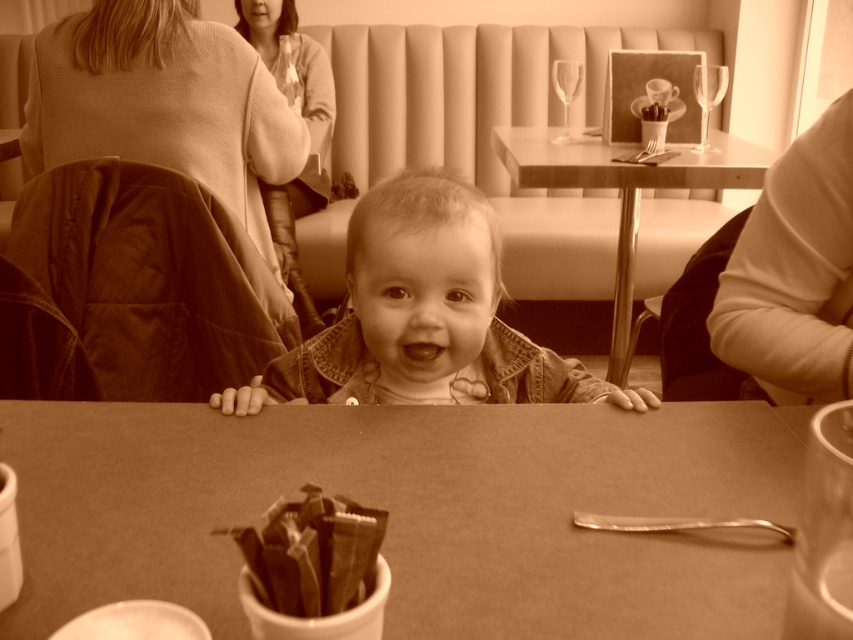
Who is shorter, smooth brown table at center or denim jacket at center?

With less height is smooth brown table at center.

Can you confirm if smooth brown table at center is positioned to the right of denim jacket at center?

No, smooth brown table at center is not to the right of denim jacket at center.

The image size is (853, 640). What do you see at coordinates (416, 512) in the screenshot?
I see `smooth brown table at center` at bounding box center [416, 512].

Identify the location of smooth brown table at center. (416, 512).

What do you see at coordinates (422, 316) in the screenshot? The image size is (853, 640). I see `denim jacket at center` at bounding box center [422, 316].

Between denim jacket at center and smooth wood table at center, which one appears on the left side from the viewer's perspective?

Positioned to the left is denim jacket at center.

Identify the location of denim jacket at center. (422, 316).

Measure the distance between point (375, 243) and camera.

They are 86.26 centimeters apart.

Who is higher up, denim jacket at center or dark brown textured packets at center?

denim jacket at center is above.

Which is in front, point (352, 326) or point (310, 531)?

Point (310, 531)

I want to click on denim jacket at center, so click(x=422, y=316).